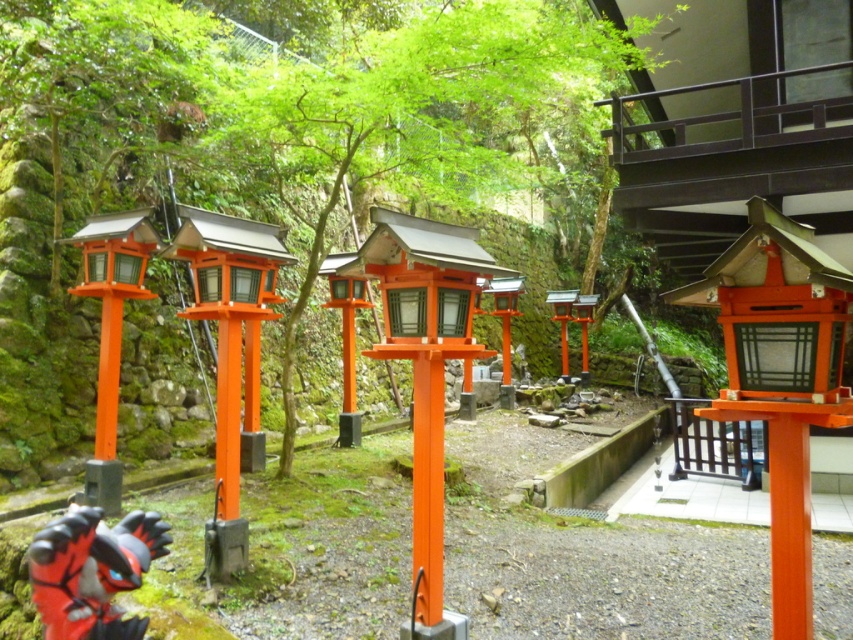
Which is in front, point (846, 316) or point (724, 476)?

Point (846, 316) is in front.

Can you confirm if matte orange wooden lantern at center is positioned above black matte gate at center?

Indeed, matte orange wooden lantern at center is positioned over black matte gate at center.

Locate an element on the screen. matte orange wooden lantern at center is located at coordinates (780, 376).

Does white tile floor at lower right appear over black matte gate at center?

Incorrect, white tile floor at lower right is not positioned above black matte gate at center.

Between point (828, 518) and point (688, 424), which one is positioned in front?

Point (828, 518) is more forward.

Locate an element on the screen. The image size is (853, 640). white tile floor at lower right is located at coordinates (685, 497).

Which is above, white tile floor at lower right or orange matte lantern at center?

orange matte lantern at center is higher up.

Who is positioned more to the left, white tile floor at lower right or orange matte lantern at center?

Positioned to the left is orange matte lantern at center.

Is point (822, 492) farther from viewer compared to point (566, 316)?

No, (822, 492) is in front of (566, 316).

This screenshot has height=640, width=853. In order to click on white tile floor at lower right in this screenshot , I will do `click(685, 497)`.